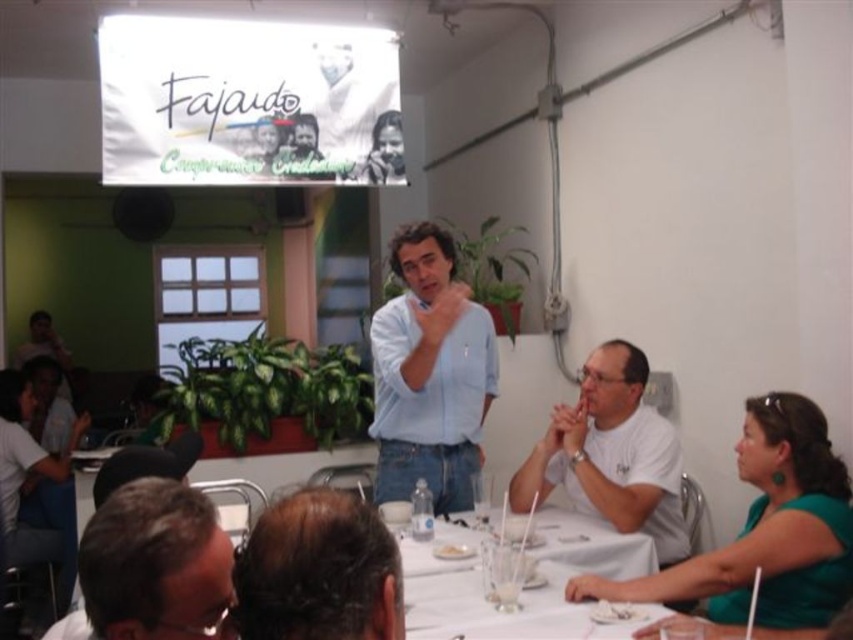
Consider the image. Does white matte shirt at lower right have a larger size compared to brown hair at lower left?

Correct, white matte shirt at lower right is larger in size than brown hair at lower left.

Does point (639, 360) come closer to viewer compared to point (132, 502)?

No, (639, 360) is further to viewer.

At what (x,y) coordinates should I click in order to perform the action: click on white matte shirt at lower right. Please return your answer as a coordinate pair (x, y). Image resolution: width=853 pixels, height=640 pixels. Looking at the image, I should click on (611, 452).

Which of these two, dark brown hair at center or white matte shirt at lower right, stands taller?

white matte shirt at lower right

Who is lower down, dark brown hair at center or white matte shirt at lower right?

Positioned lower is white matte shirt at lower right.

Does point (254, 545) come farther from viewer compared to point (679, 524)?

No, it is not.

Where is `dark brown hair at center`? The height and width of the screenshot is (640, 853). dark brown hair at center is located at coordinates (318, 572).

In the scene shown: Can you confirm if green matte dress at lower right is smaller than brown hair at lower left?

No, green matte dress at lower right is not smaller than brown hair at lower left.

Can you confirm if green matte dress at lower right is thinner than brown hair at lower left?

Incorrect, green matte dress at lower right's width is not less than brown hair at lower left's.

Measure the distance between point (836, 516) and camera.

Point (836, 516) and camera are 1.83 meters apart.

Where is `green matte dress at lower right`? green matte dress at lower right is located at coordinates (767, 531).